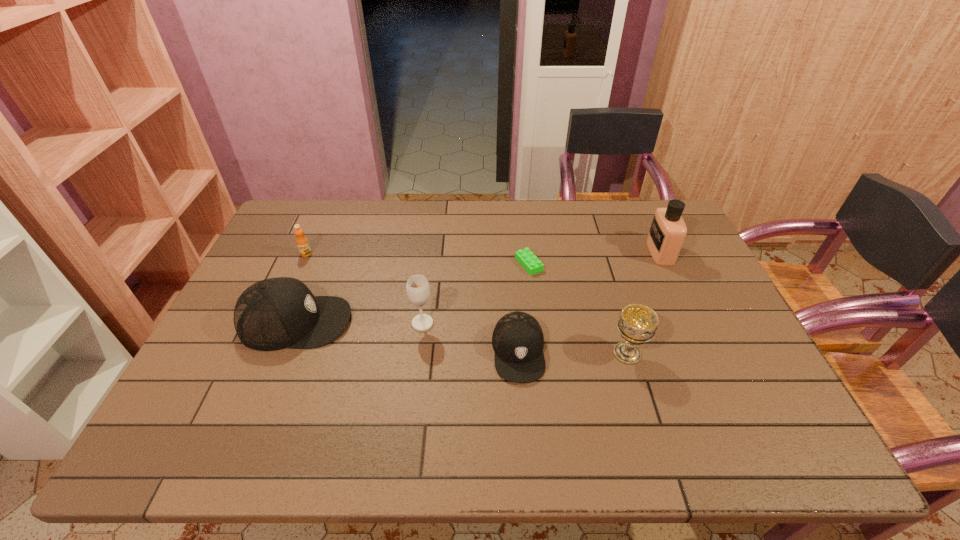
Locate an element on the screen. orange juice that is at the left edge is located at coordinates (302, 242).

You are a GUI agent. You are given a task and a screenshot of the screen. Output one action in this format:
    pyautogui.click(x=<x>, y=<y>)
    Task: Click on the object that is at the right edge
    Image resolution: width=960 pixels, height=540 pixels.
    Given the screenshot: What is the action you would take?
    pyautogui.click(x=668, y=230)

Locate an element on the screen. object present at the far right corner is located at coordinates (668, 230).

What are the coordinates of `vacant space at the far edge` in the screenshot? It's located at (528, 241).

At what (x,y) coordinates should I click in order to perform the action: click on free spot at the near edge of the desktop. Please return your answer as a coordinate pair (x, y). The image size is (960, 540). Looking at the image, I should click on [319, 392].

You are a GUI agent. You are given a task and a screenshot of the screen. Output one action in this format:
    pyautogui.click(x=<x>, y=<y>)
    Task: Click on the free space at the left edge
    Image resolution: width=960 pixels, height=540 pixels.
    Given the screenshot: What is the action you would take?
    pyautogui.click(x=273, y=252)

Identify the location of vacant position at the right edge of the desktop. (708, 285).

Find the location of a particular element. This screenshot has width=960, height=540. blank area at the near left corner is located at coordinates coord(250,396).

Image resolution: width=960 pixels, height=540 pixels. Identify the location of vacant region at the far right corner of the desktop. (638, 212).

Where is `free space at the near right corner of the desktop`? This screenshot has width=960, height=540. free space at the near right corner of the desktop is located at coordinates (734, 406).